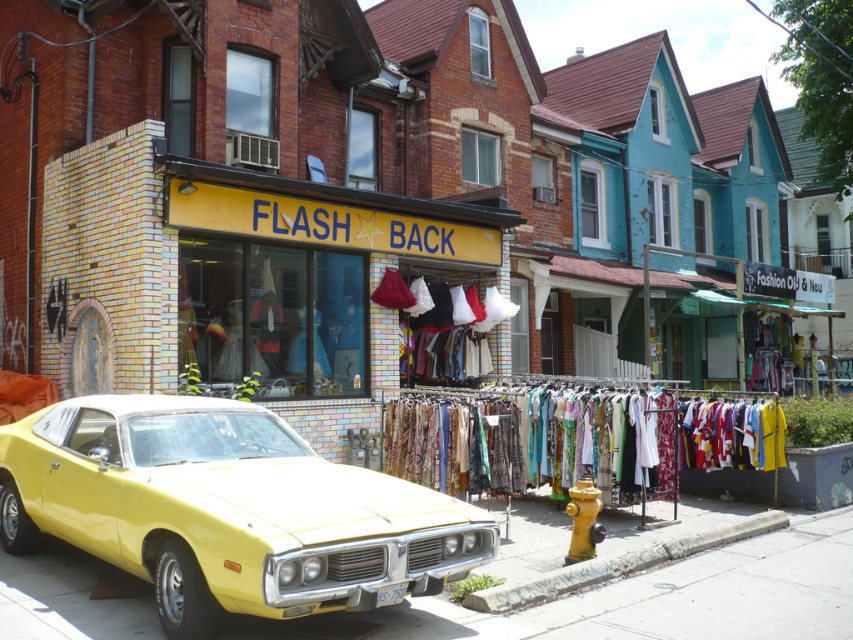
You are a customer looking to park your car in front of the store. The shiny yellow car at center and the yellow concrete pavement at lower left are in your way. Which object should you move to make space?

The shiny yellow car at center is positioned on the left side of yellow concrete pavement at lower left. Since the pavement is part of the ground, you should move the shiny yellow car at center to make space for parking.

You are standing at the point marked by the coordinates point (619, 564). What type of surface are you standing on?

You are standing on a smooth concrete curb at lower center.

You are a delivery person trying to park your delivery van, which is 6 meters long, in the space between the shiny yellow car at center and the smooth concrete curb at lower center. Can your van fit there?

The shiny yellow car at center is bigger than the smooth concrete curb at lower center, so the space between them may not be sufficient for a 6 meter long van. You should look for a larger parking spot.